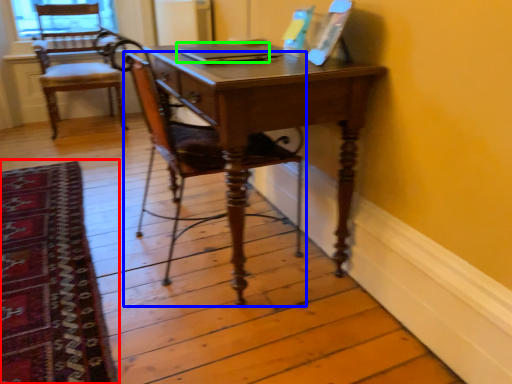
Question: Estimate the real-world distances between objects in this image. Which object is farther from mat (highlighted by a red box), chair (highlighted by a blue box) or laptop (highlighted by a green box)?

Choices:
 (A) chair
 (B) laptop

Answer: (B)